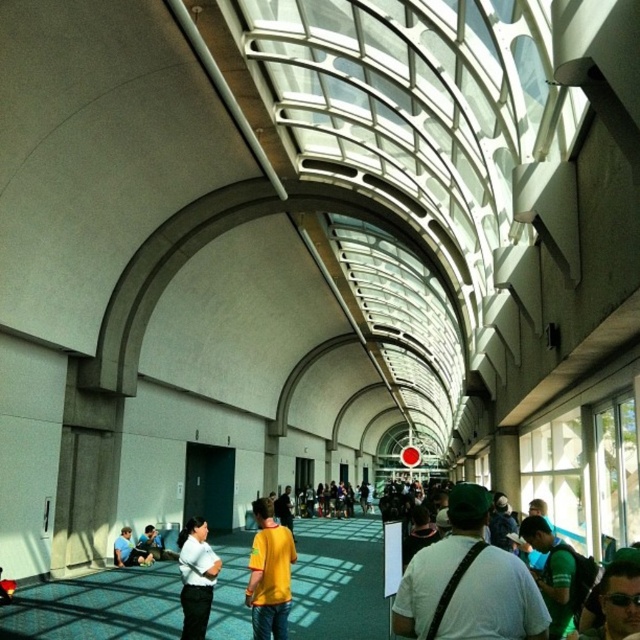
Question: Which object is farther from the camera taking this photo?

Choices:
 (A) yellow t-shirt at center
 (B) white matte shirt at center
 (C) yellow matte shirt at center

Answer: (A)

Question: Can you confirm if yellow t-shirt at center is positioned above blue denim jeans at lower left?

Choices:
 (A) yes
 (B) no

Answer: (B)

Question: Which point appears farthest from the camera in this image?

Choices:
 (A) (204, 573)
 (B) (292, 547)

Answer: (A)

Question: Which of the following is the closest to the observer?

Choices:
 (A) (572, 608)
 (B) (278, 563)
 (C) (141, 557)

Answer: (A)

Question: Does white matte t-shirt at center appear on the right side of white matte shirt at center?

Choices:
 (A) no
 (B) yes

Answer: (B)

Question: Can you confirm if green fabric shirt at lower right is positioned to the left of blue denim jeans at lower left?

Choices:
 (A) no
 (B) yes

Answer: (A)